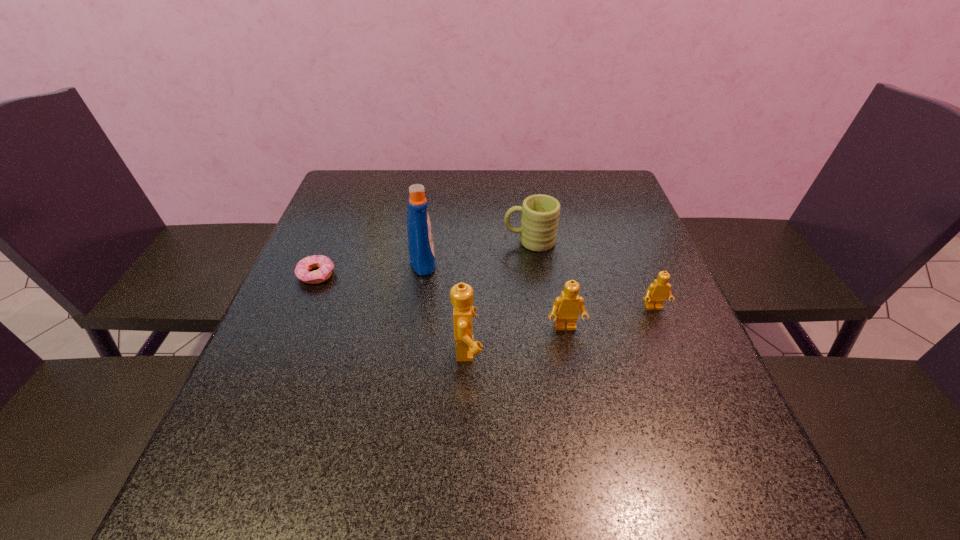
Identify the location of the tallest Lego. (462, 295).

In order to click on the third object from left to right in this screenshot , I will do `click(462, 295)`.

At what (x,y) coordinates should I click in order to perform the action: click on the second Lego from right to left. Please return your answer as a coordinate pair (x, y). Looking at the image, I should click on (566, 309).

This screenshot has height=540, width=960. In order to click on the rightmost object in this screenshot , I will do `click(657, 292)`.

This screenshot has width=960, height=540. Find the location of `the shortest Lego`. the shortest Lego is located at coordinates coord(657,292).

Locate an element on the screen. This screenshot has height=540, width=960. detergent is located at coordinates (420, 241).

You are a GUI agent. You are given a task and a screenshot of the screen. Output one action in this format:
    pyautogui.click(x=<x>, y=<y>)
    Task: Click on the fifth object from right to left
    This screenshot has width=960, height=540.
    Given the screenshot: What is the action you would take?
    click(x=420, y=241)

Identify the location of mug. (540, 213).

Locate an element on the screen. the shortest object is located at coordinates (325, 265).

This screenshot has height=540, width=960. What are the coordinates of `doughnut` in the screenshot? It's located at (325, 265).